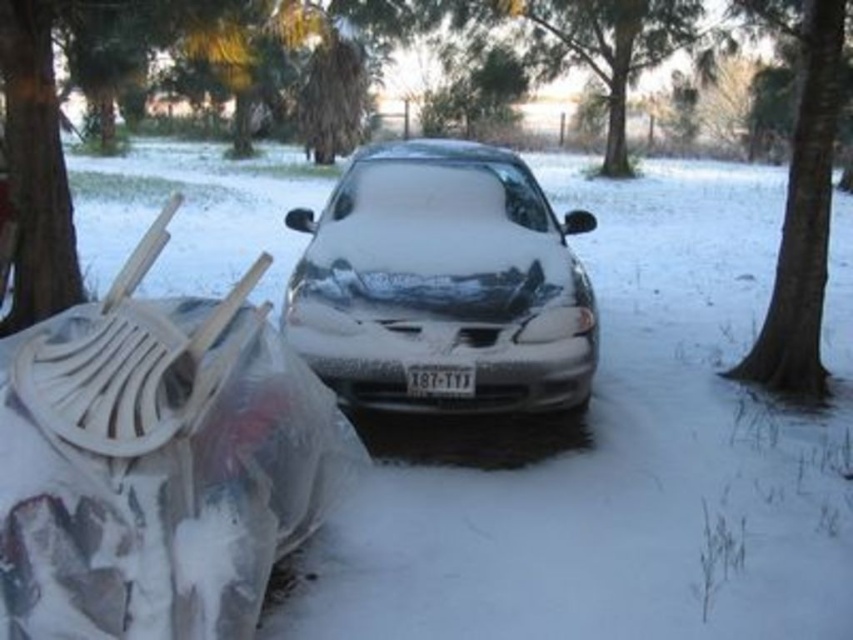
You are standing at the center of the snowy scene and want to locate the smooth bark tree at center. According to the coordinates provided, in which direction should you look to find it?

The smooth bark tree at center is located at coordinates point (804, 221), so you should look towards the bottom of the scene since the y coordinate is closer to 1, which typically represents the bottom in image coordinate systems.

You are a delivery person trying to park your van next to the sleek metallic car at center and the smooth bark tree at center. Based on their widths, can you determine which one you should avoid hitting to prevent damage?

The sleek metallic car at center might be wider than smooth bark tree at center, so you should avoid hitting the sleek metallic car at center to prevent damage.